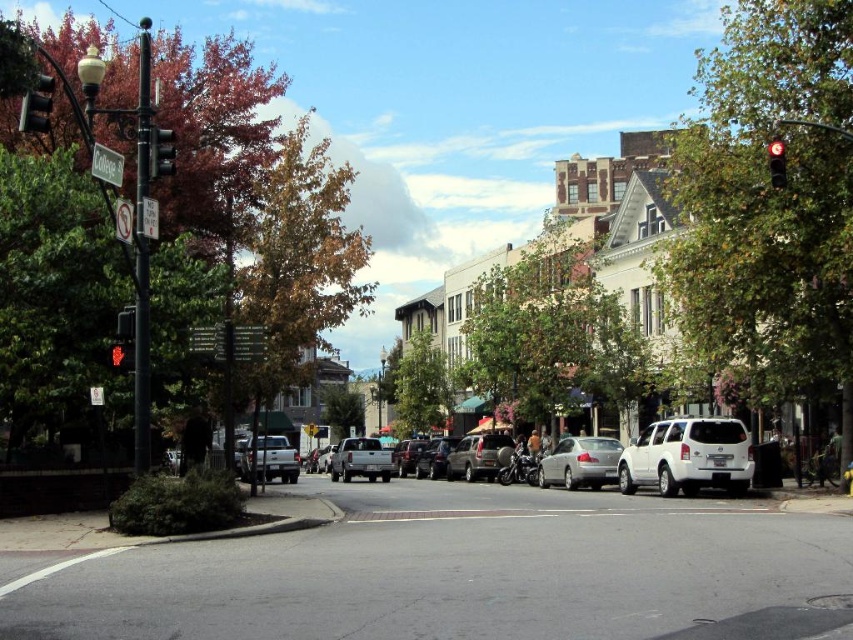
You are standing at the lamppost with the College sign. You want to walk to the white matte suv at center. Which direction should you walk to reach it?

The white matte suv at center is located at coordinates 0.714 on the x axis and 0.808 on the y axis. Since you are at the lamppost with the College sign at the corner, you should walk towards the center of the street where the suv is positioned.

You are a delivery driver who needs to park your vehicle in a space that can only accommodate cars no larger than the white matte suv at center. You have a vehicle similar in size to the satin silver sedan at center. Based on the scene, can you fit your car into the parking space?

The white matte suv at center is smaller than the satin silver sedan at center. Since the parking space can only accommodate cars no larger than the white matte suv at center, your vehicle, which is the size of the satin silver sedan at center, would be too big to fit into the parking space.

You are a pedestrian waiting at the crosswalk. You see the white matte suv at center and the metallic traffic light at upper left. Which object is closer to you?

The white matte suv at center is closer to you than the metallic traffic light at upper left.